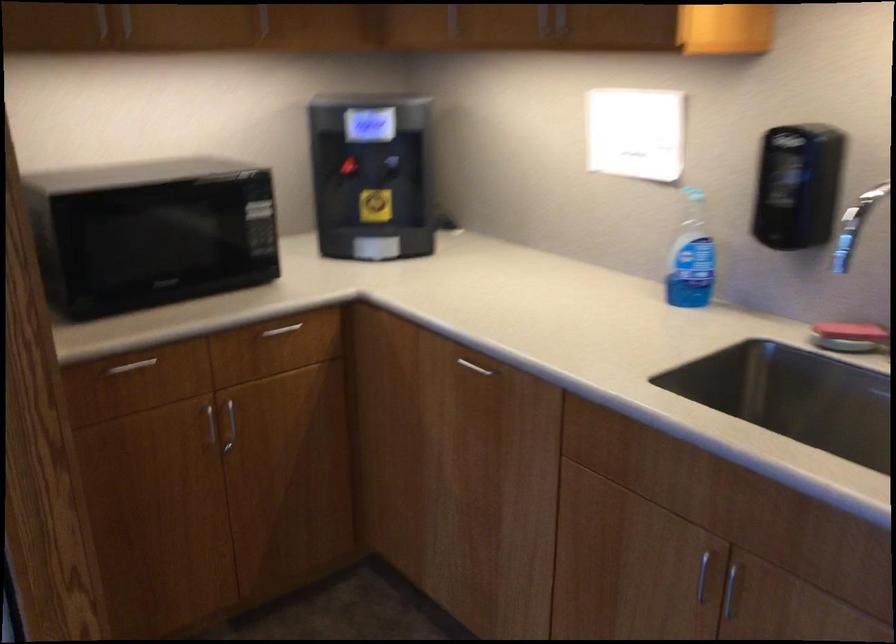
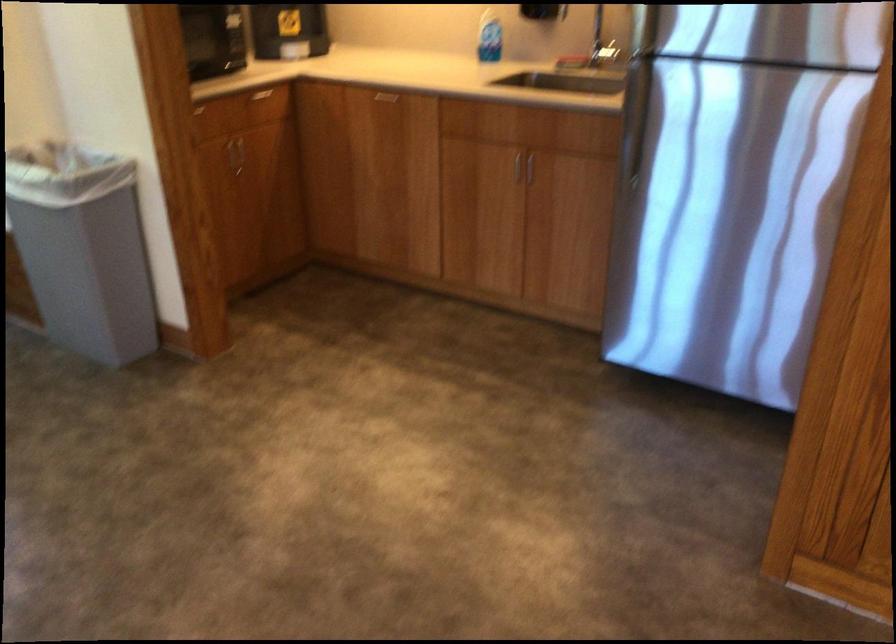
Locate, in the second image, the point that corresponds to the point at 722,576 in the first image.

(524, 166)